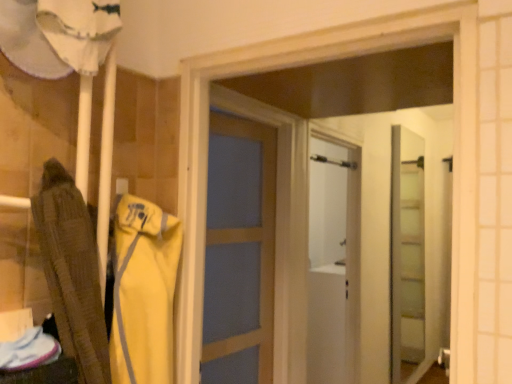
This screenshot has width=512, height=384. Describe the element at coordinates (407, 253) in the screenshot. I see `clear glass door at center` at that location.

I want to click on clear glass door at center, so click(x=407, y=253).

What is the approximate width of clear glass door at center?

9.08 centimeters.

The width and height of the screenshot is (512, 384). Describe the element at coordinates (143, 292) in the screenshot. I see `yellow fabric at left` at that location.

Identify the location of yellow fabric at left. This screenshot has height=384, width=512. (143, 292).

Where is `clear glass door at center`? clear glass door at center is located at coordinates (407, 253).

Which object is positioned more to the left, clear glass door at center or yellow fabric at left?

yellow fabric at left is more to the left.

Between clear glass door at center and yellow fabric at left, which one is positioned behind?

clear glass door at center is behind.

Is point (415, 340) positioned behind point (137, 318)?

Yes, point (415, 340) is behind point (137, 318).

From the image's perspective, relative to yellow fabric at left, is clear glass door at center above or below?

clear glass door at center is situated lower than yellow fabric at left in the image.

From a real-world perspective, is clear glass door at center physically located above or below yellow fabric at left?

→ From a real-world perspective, clear glass door at center is physically below yellow fabric at left.

Which of these two, clear glass door at center or yellow fabric at left, is thinner?

clear glass door at center is thinner.

Does clear glass door at center have a greater height compared to yellow fabric at left?

Indeed, clear glass door at center has a greater height compared to yellow fabric at left.

Who is smaller, clear glass door at center or yellow fabric at left?

yellow fabric at left.

Based on the photo, is yellow fabric at left surrounded by clear glass door at center?

Actually, yellow fabric at left is outside clear glass door at center.

Is clear glass door at center far from yellow fabric at left?

Yes, clear glass door at center and yellow fabric at left are located far from each other.

Does clear glass door at center turn towards yellow fabric at left?

No, clear glass door at center does not turn towards yellow fabric at left.

In the image, there is a clear glass door at center. Where is `clothing above it (from the image's perspective)`? This screenshot has width=512, height=384. clothing above it (from the image's perspective) is located at coordinates (143, 292).

Considering the relative positions of yellow fabric at left and clear glass door at center in the image provided, is yellow fabric at left to the left or to the right of clear glass door at center?

yellow fabric at left is to the left of clear glass door at center.

Is yellow fabric at left further to the viewer compared to clear glass door at center?

No, yellow fabric at left is closer to the viewer.

Is point (127, 354) positioned before point (401, 190)?

Yes, it is in front of point (401, 190).

Looking at this image, from the image's perspective, does yellow fabric at left appear lower than clear glass door at center?

Incorrect, from the image's perspective, yellow fabric at left is higher than clear glass door at center.

From the picture: From a real-world perspective, is yellow fabric at left over clear glass door at center?

Indeed, from a real-world perspective, yellow fabric at left stands above clear glass door at center.

Does yellow fabric at left have a lesser width compared to clear glass door at center?

No, yellow fabric at left is not thinner than clear glass door at center.

Which of these two, yellow fabric at left or clear glass door at center, stands taller?

Standing taller between the two is clear glass door at center.

Based on the photo, who is smaller, yellow fabric at left or clear glass door at center?

Smaller between the two is yellow fabric at left.

Would you say clear glass door at center is part of yellow fabric at left's contents?

No.

Is yellow fabric at left touching clear glass door at center?

yellow fabric at left and clear glass door at center are not in contact.

Is yellow fabric at left looking in the opposite direction of clear glass door at center?

No, yellow fabric at left's orientation is not away from clear glass door at center.

How different are the orientations of yellow fabric at left and clear glass door at center in degrees?

The angle between the facing direction of yellow fabric at left and the facing direction of clear glass door at center is 178 degrees.

Based on the photo, how distant is yellow fabric at left from clear glass door at center?

They are 3.26 meters apart.

Identify the location of clothing above the clear glass door at center (from a real-world perspective). coord(143,292).

Find the location of `clothing located above the clear glass door at center (from the image's perspective)`. clothing located above the clear glass door at center (from the image's perspective) is located at coordinates (143, 292).

Image resolution: width=512 pixels, height=384 pixels. I want to click on clothing on the left side of clear glass door at center, so click(143, 292).